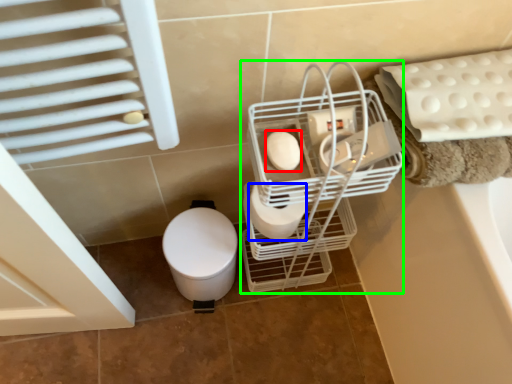
Question: Based on their relative distances, which object is nearer to toilet paper (highlighted by a red box)? Choose from toilet paper (highlighted by a blue box) and trolley (highlighted by a green box).

Choices:
 (A) toilet paper
 (B) trolley

Answer: (A)